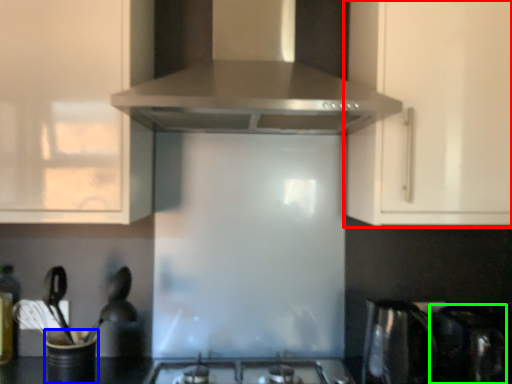
Question: Which object is positioned closest to cabinetry (highlighted by a red box)? Select from appliance (highlighted by a blue box) and appliance (highlighted by a green box).

Choices:
 (A) appliance
 (B) appliance

Answer: (B)